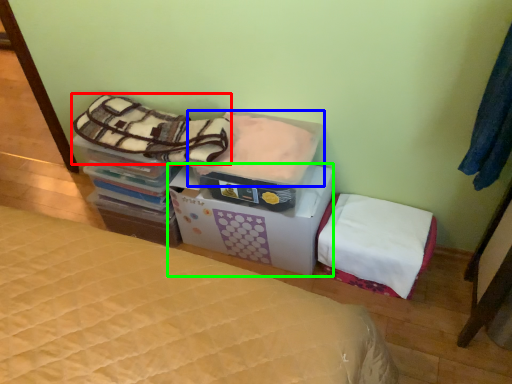
Question: Considering the real-world distances, which object is closest to blanket (highlighted by a red box)? blanket (highlighted by a blue box) or cardboard box (highlighted by a green box).

Choices:
 (A) blanket
 (B) cardboard box

Answer: (A)